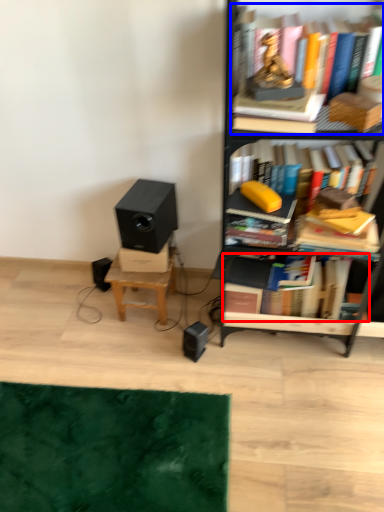
Question: Which of the following is the closest to the observer, book (highlighted by a red box) or book (highlighted by a blue box)?

Choices:
 (A) book
 (B) book

Answer: (B)